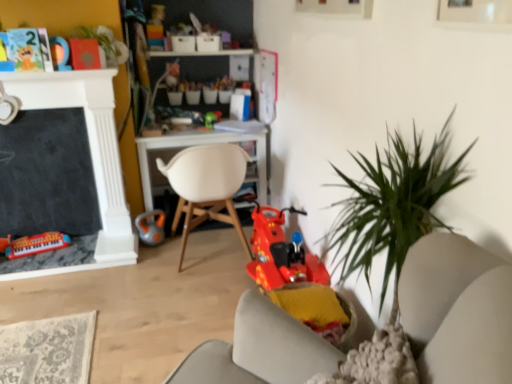
This screenshot has width=512, height=384. What are the coordinates of `unoccupied region to the right of orange rubber kettlebell at center, placed as the third toy when sorted from left to right` in the screenshot? It's located at (182, 241).